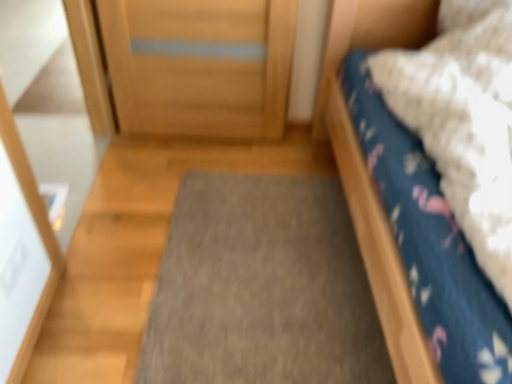
You are a GUI agent. You are given a task and a screenshot of the screen. Output one action in this format:
    pyautogui.click(x=<x>, y=<y>)
    Task: Click on the vacant space situated on the left part of gray carpet at center
    
    Given the screenshot: What is the action you would take?
    pyautogui.click(x=120, y=248)